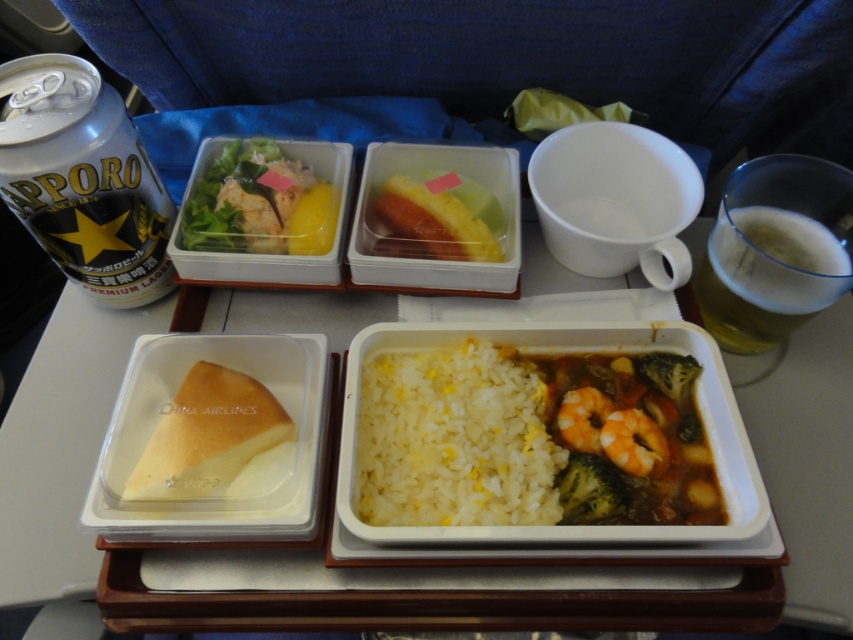
You are a passenger on an airplane and want to reach the silver metallic can at upper left to get a drink. However, the white matte rice at center is blocking your access. Can you move the rice to the side to access the can?

The white matte rice at center is in front of the silver metallic can at upper left, so you can move the rice to the side to access the can.

You are a flight attendant checking the meal portions. The airline requires that the main dish must be larger than any side dish. Does the white matte rice at center meet this requirement when compared to the green matte salad at upper left?

The white matte rice at center has a larger size compared to the green matte salad at upper left, so it meets the airline requirement.